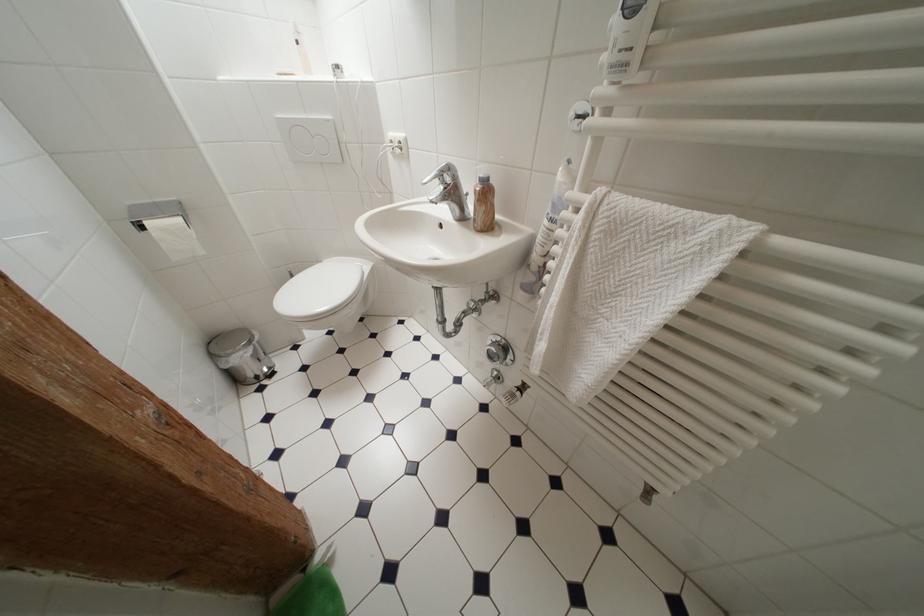
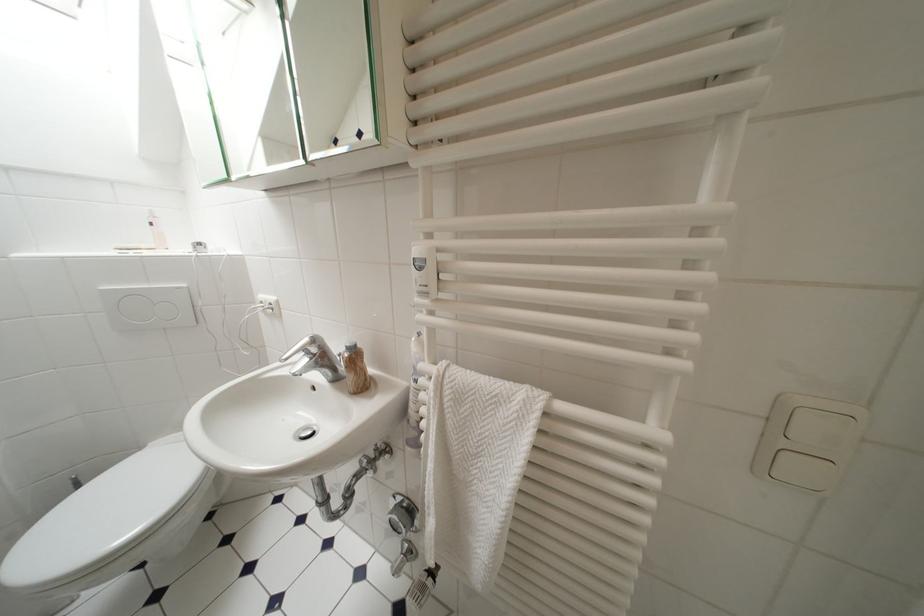
Based on the continuous images, in which direction is the camera rotating?

The rotation direction of the camera is right-up.